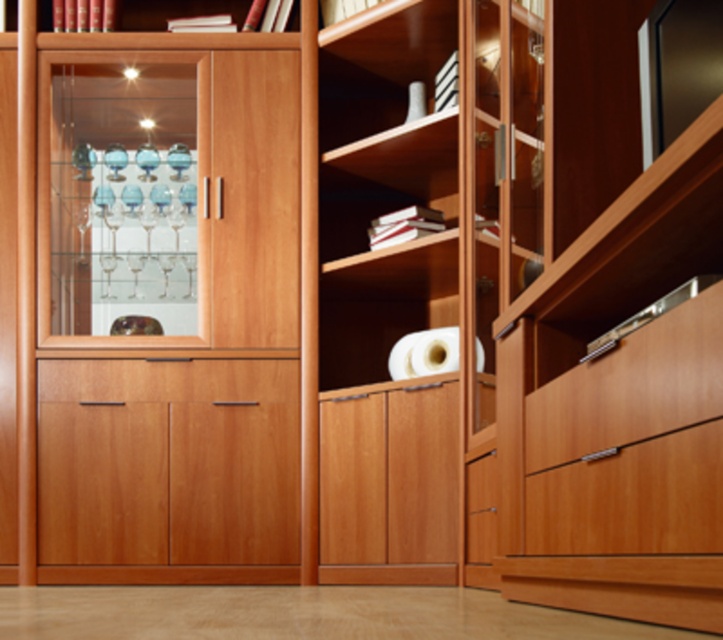
Question: Can you confirm if transparent glass cabinet at left is thinner than wooden drawer at lower right?

Choices:
 (A) no
 (B) yes

Answer: (A)

Question: Is wooden cabinet at center smaller than transparent glass cabinet at left?

Choices:
 (A) yes
 (B) no

Answer: (A)

Question: Which point is closer to the camera?

Choices:
 (A) (192, 298)
 (B) (218, 396)

Answer: (B)

Question: Which point is closer to the camera?

Choices:
 (A) (231, 490)
 (B) (578, 376)

Answer: (B)

Question: Does transparent glass cabinet at left come in front of wooden drawer at lower right?

Choices:
 (A) no
 (B) yes

Answer: (A)

Question: Among these points, which one is nearest to the camera?

Choices:
 (A) (604, 413)
 (B) (265, 540)
 (C) (55, 129)

Answer: (A)